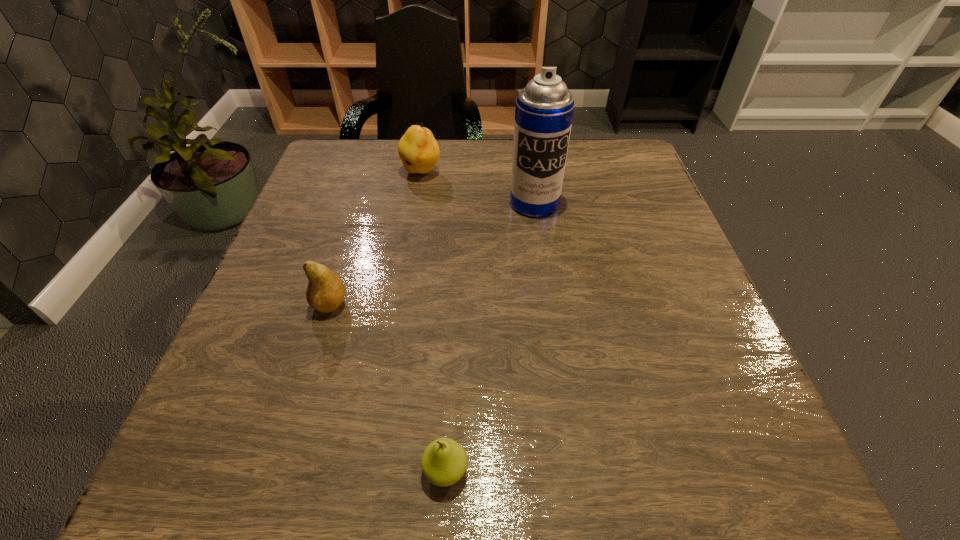
At what (x,y) coordinates should I click in order to perform the action: click on vacant space at the far left corner of the desktop. Please return your answer as a coordinate pair (x, y). Looking at the image, I should click on (332, 147).

At what (x,y) coordinates should I click in order to perform the action: click on vacant space at the far right corner. Please return your answer as a coordinate pair (x, y). Looking at the image, I should click on (608, 140).

Locate an element on the screen. vacant space at the near right corner of the desktop is located at coordinates coord(758,481).

Image resolution: width=960 pixels, height=540 pixels. What are the coordinates of `empty location between the tallest object and the leftmost object` in the screenshot? It's located at (432, 254).

Locate an element on the screen. This screenshot has width=960, height=540. free spot between the rightmost pear and the third farthest object is located at coordinates (388, 387).

At what (x,y) coordinates should I click in order to perform the action: click on vacant region between the leftmost object and the shortest pear. Please return your answer as a coordinate pair (x, y). Looking at the image, I should click on (388, 387).

The width and height of the screenshot is (960, 540). Find the location of `vacant area that lies between the shortest object and the rightmost object`. vacant area that lies between the shortest object and the rightmost object is located at coordinates (490, 337).

At what (x,y) coordinates should I click in order to perform the action: click on free space between the second pear from left to right and the rightmost object. Please return your answer as a coordinate pair (x, y). The height and width of the screenshot is (540, 960). Looking at the image, I should click on point(478,188).

The height and width of the screenshot is (540, 960). What are the coordinates of `free spot between the leftmost object and the shortest pear` in the screenshot? It's located at (388, 387).

You are a GUI agent. You are given a task and a screenshot of the screen. Output one action in this format:
    pyautogui.click(x=<x>, y=<y>)
    Task: Click on the free space between the leftmost pear and the farthest pear
    
    Given the screenshot: What is the action you would take?
    pyautogui.click(x=375, y=238)